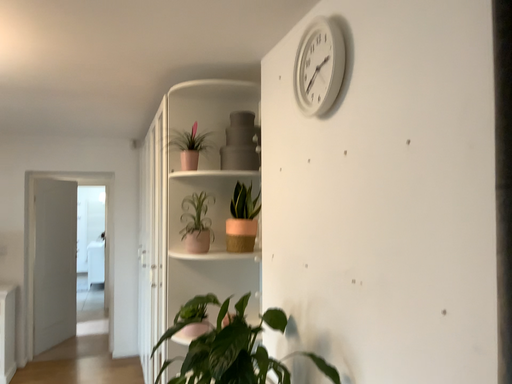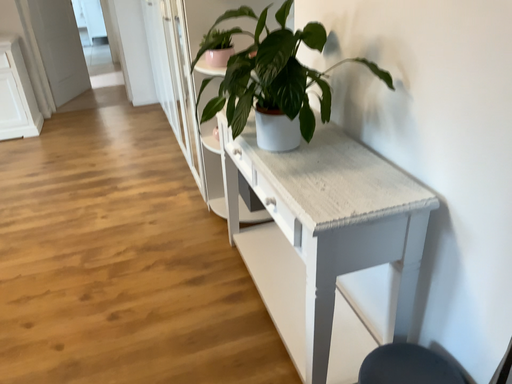
Question: How did the camera likely rotate when shooting the video?

Choices:
 (A) rotated downward
 (B) rotated upward

Answer: (A)